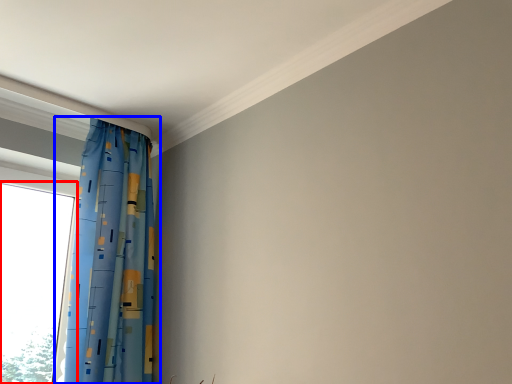
Question: Among these objects, which one is nearest to the camera, window (highlighted by a red box) or curtain (highlighted by a blue box)?

Choices:
 (A) window
 (B) curtain

Answer: (B)